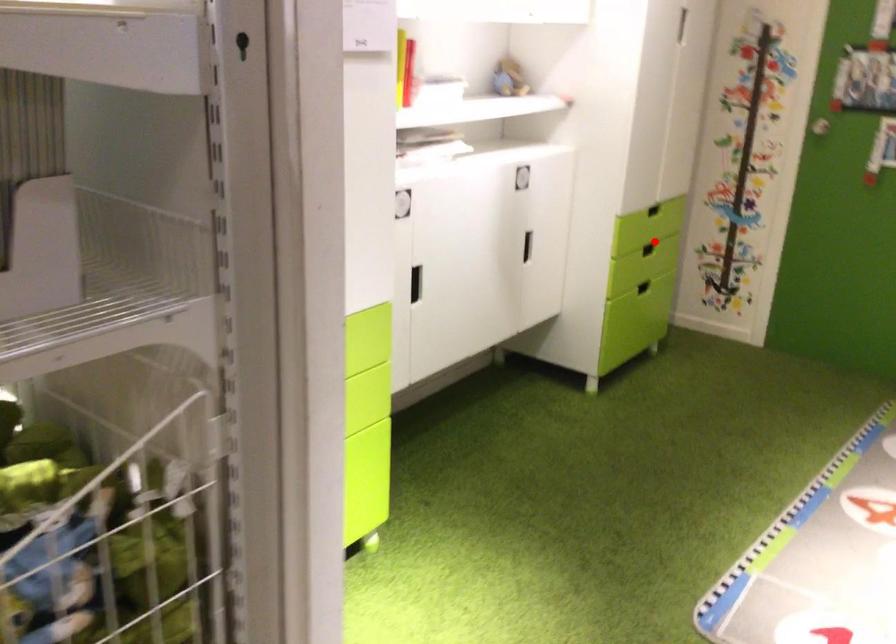
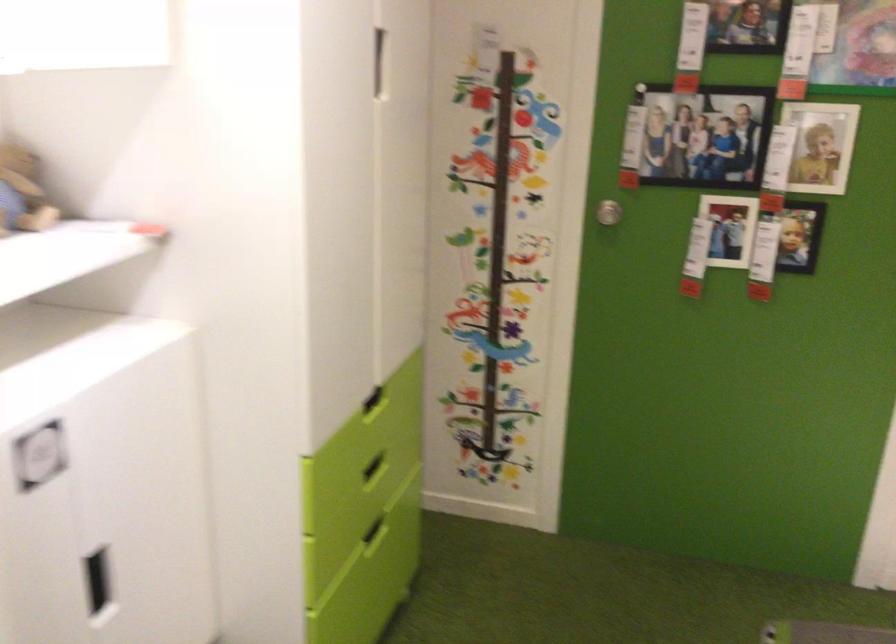
Locate, in the second image, the point that corresponds to the highlighted location in the first image.

(374, 468)